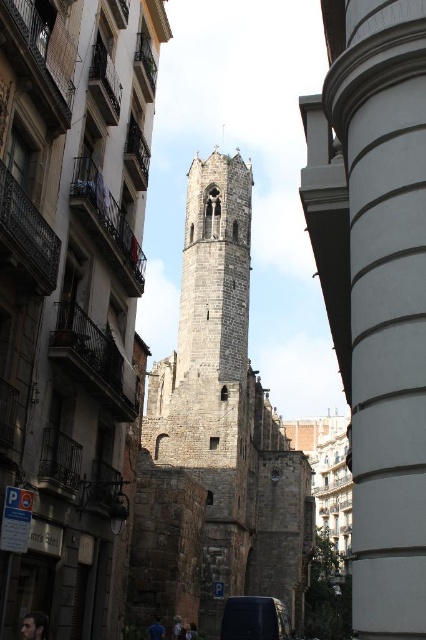
You are standing at the entrance of the street and want to take a photo of the dark gray stone tower at center. Where should you position yourself to capture the tower in the center of your camera frame?

To capture the dark gray stone tower at center in the center of your camera frame, position yourself directly in front of the tower along the street. Since the tower is located at point (216, 433) in the image coordinates, aligning your camera with this central point will ensure the tower is centered in your photo.

Based on the photo, you are standing on the street looking at the historic stone tower in the background. There are two points marked on the image. One is at coordinates point (184, 406) and the other at point (279, 618). Which point is closer to you?

Point (279, 618) is closer to you because point (184, 406) is behind it.

You are a tourist standing on the narrow urban street and want to take a photo of the dark gray stone tower at center and the dark blue matte van at center. Since the street is narrow, you need to know which object is bigger to frame your shot properly. Which one is larger?

The dark gray stone tower at center is larger than the dark blue matte van at center, so you should frame your shot to accommodate its size.